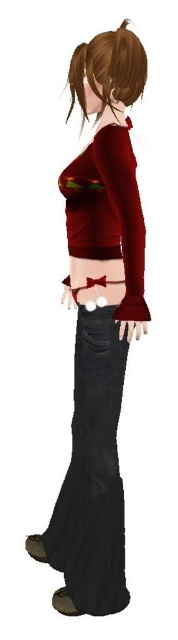
You are a tailor measuring the distance between the matte red blouse at center and the brown matte hair at upper center for a custom fit. Given that the minimum required distance for proper tailoring is 20 centimeters, can the current spacing between these two items be sufficient?

The distance between the matte red blouse at center and the brown matte hair at upper center is 21.44 centimeters, which exceeds the minimum required 20 centimeters. Therefore, the current spacing is sufficient for proper tailoring.

You are trying to decide whether to wear the matte red blouse at center with your black matte pocket at lower center jeans. Based on their widths, will the blouse be wider than the pocket?

The matte red blouse at center is wider than the black matte pocket at lower center because the description states that the blouse surpasses the pocket in width.